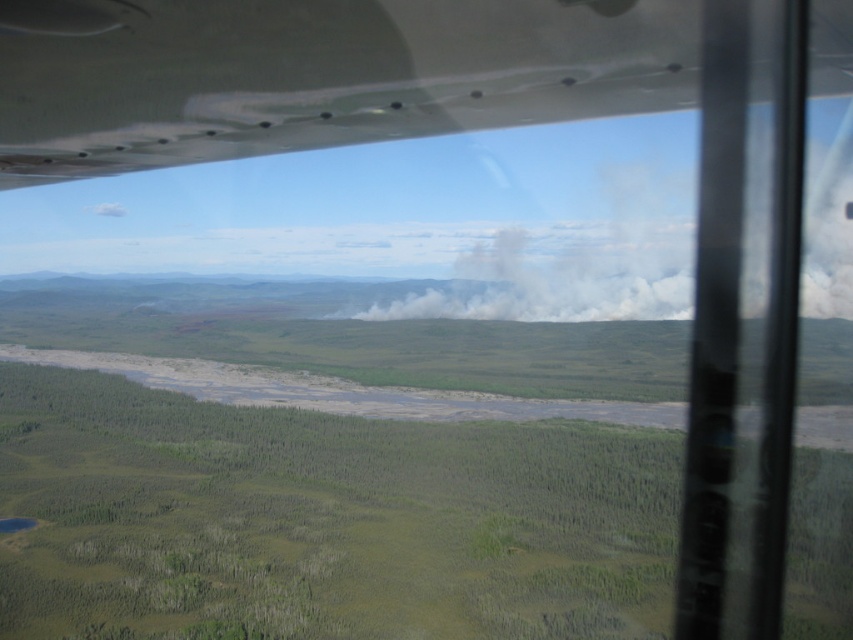
From the picture: You are a passenger on the aircraft and notice the smooth white wing at upper left and the white smoke at center. Which object is closer to you, the passenger?

The smooth white wing at upper left is closer to you because it is in front of the white smoke at center, blocking part of its view.

Consider the image. You are a passenger on the aircraft and notice two objects outside the window. You see the smooth white wing at upper left and the white smoke at center. Which object is positioned to the left of the other?

The smooth white wing at upper left is to the left of the white smoke at center.